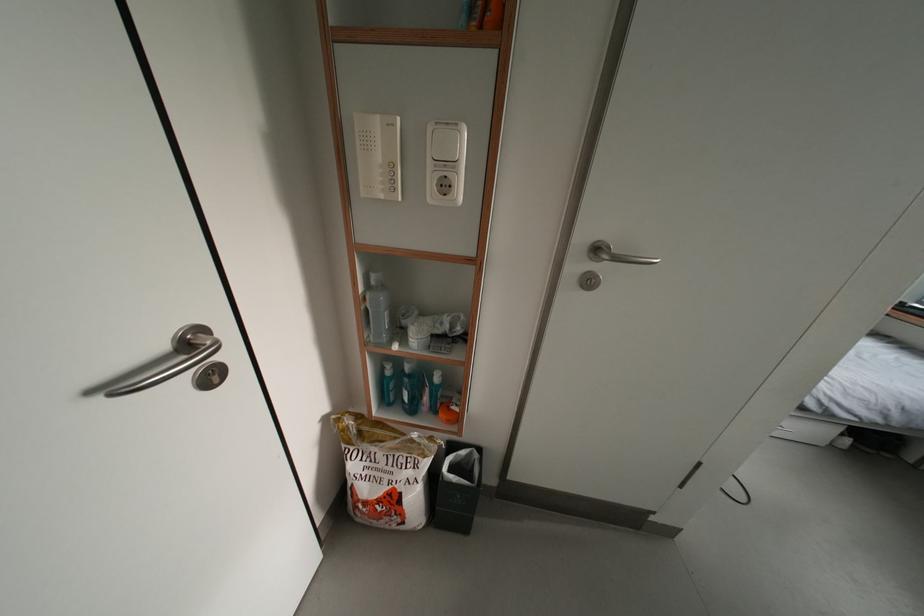
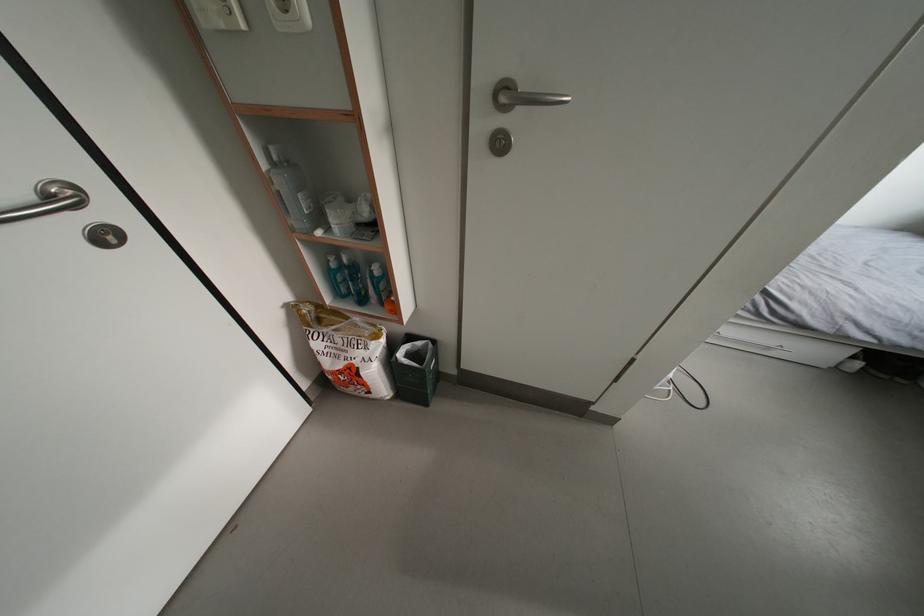
The point at (469, 458) is marked in the first image. Where is the corresponding point in the second image?

(427, 349)